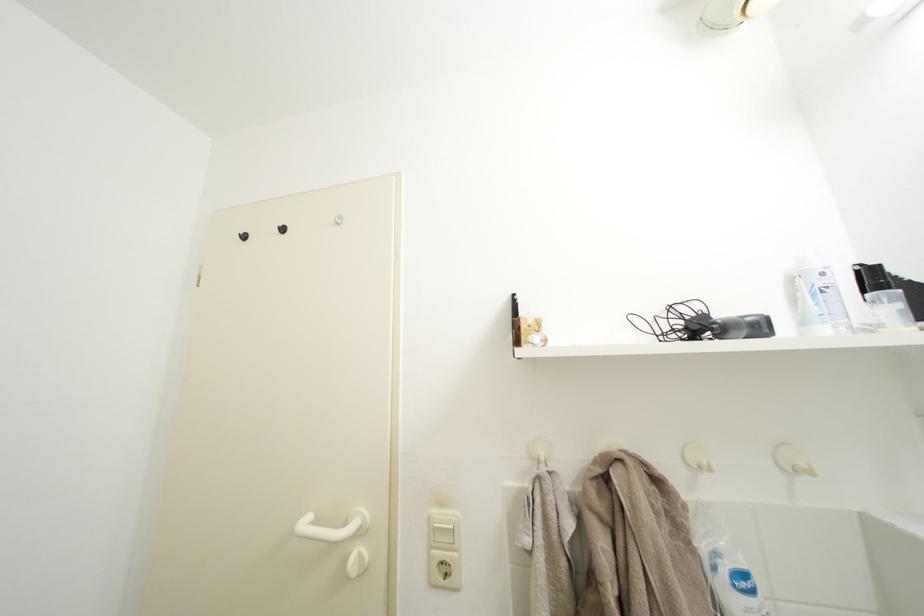
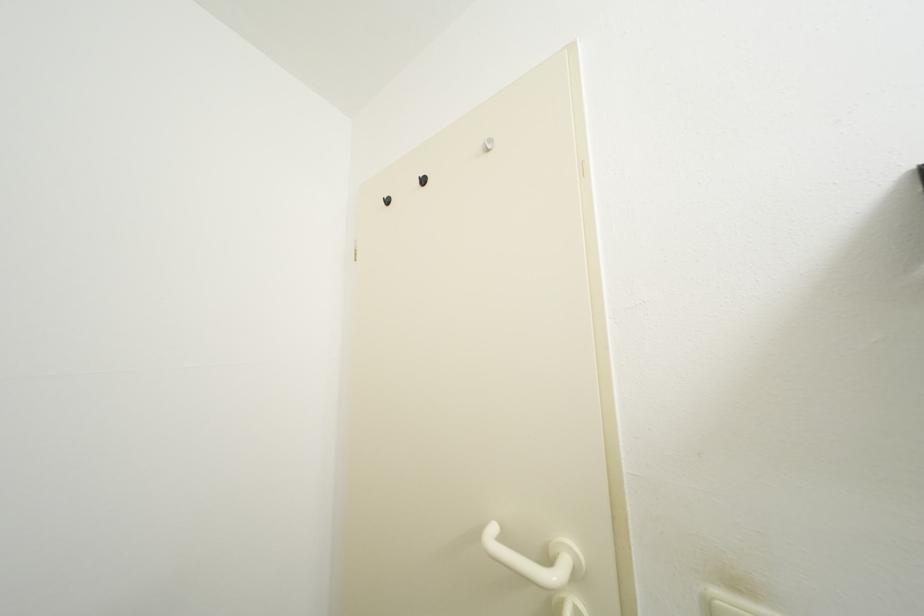
Question: How did the camera likely rotate?

Choices:
 (A) Left
 (B) Right
 (C) Up
 (D) Down

Answer: (A)